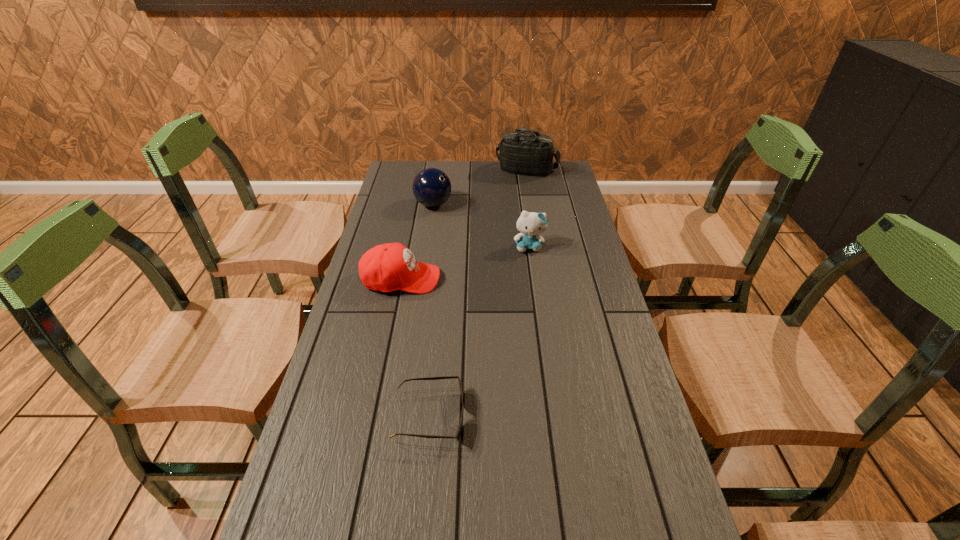
At what (x,y) coordinates should I click in order to perform the action: click on free space at the left edge of the desktop. Please return your answer as a coordinate pair (x, y). Looking at the image, I should click on (414, 202).

This screenshot has height=540, width=960. Identify the location of free location at the right edge. (599, 337).

Locate an element on the screen. Image resolution: width=960 pixels, height=540 pixels. free space at the far left corner of the desktop is located at coordinates (414, 173).

Find the location of a particular element. The height and width of the screenshot is (540, 960). vacant space at the far right corner of the desktop is located at coordinates (564, 172).

Identify the location of free space between the tallest object and the nearest object. The width and height of the screenshot is (960, 540). (478, 293).

Locate an element on the screen. The width and height of the screenshot is (960, 540). unoccupied area between the baseball cap and the kitten is located at coordinates (466, 263).

The image size is (960, 540). In order to click on free space between the nearest object and the kitten in this screenshot , I will do `click(479, 332)`.

Where is `vacant point located between the farthest object and the fourth tallest object`? vacant point located between the farthest object and the fourth tallest object is located at coordinates (464, 225).

The height and width of the screenshot is (540, 960). I want to click on vacant region between the fourth nearest object and the kitten, so click(x=481, y=226).

Identify the location of free space between the second shortest object and the farthest object. This screenshot has height=540, width=960. (464, 225).